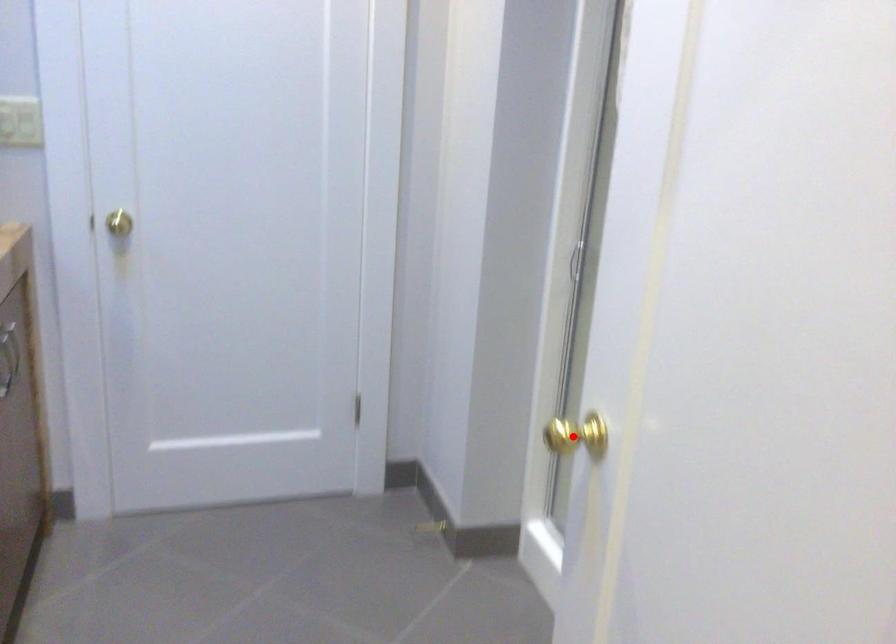
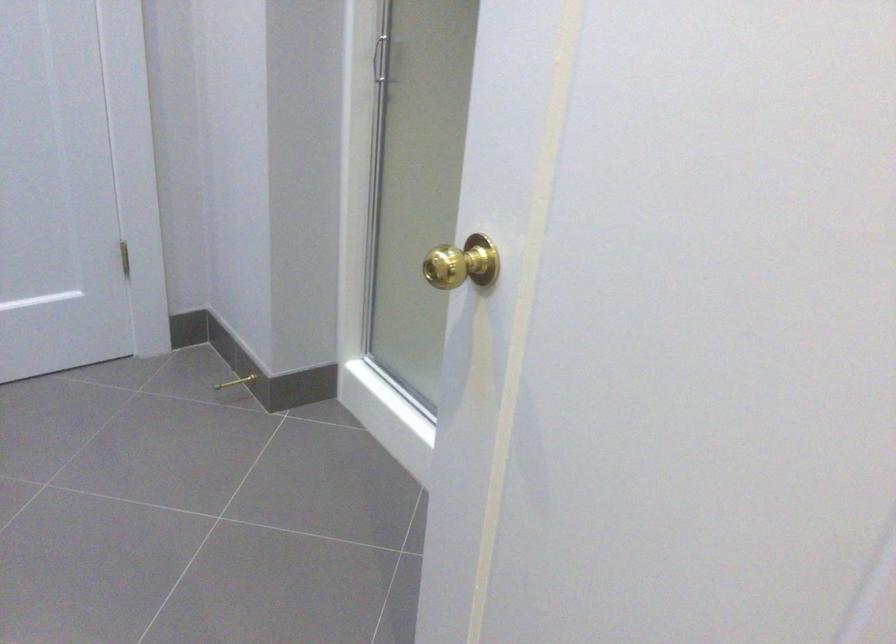
Question: I am providing you with two images of the same scene from different viewpoints. Image1 has a red point marked. In image2, the corresponding 3D location appears at what relative position? Reply with the corresponding letter.

Choices:
 (A) Closer
 (B) Farther

Answer: (A)